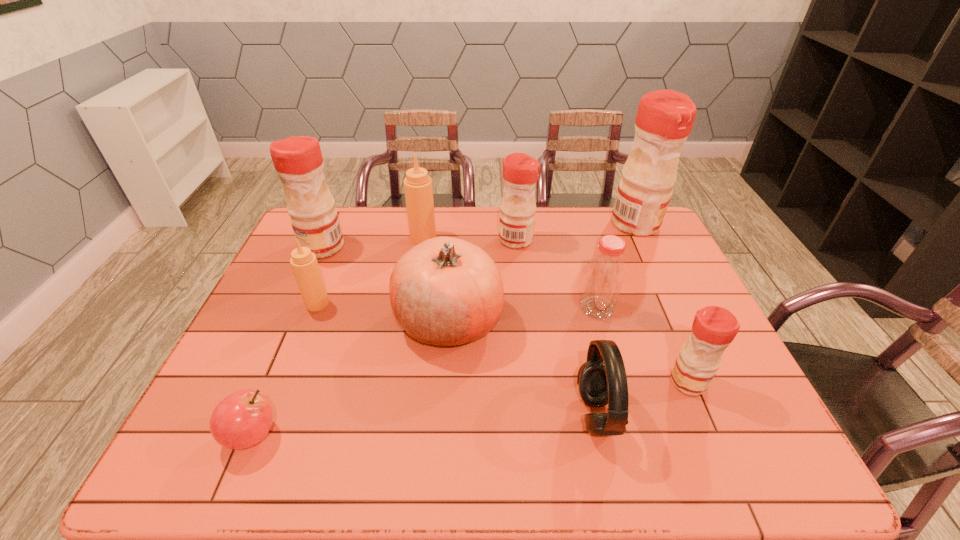
What are the coordinates of `apple at the near edge` in the screenshot? It's located at (241, 420).

The height and width of the screenshot is (540, 960). I want to click on apple at the left edge, so click(241, 420).

I want to click on object at the far left corner, so click(298, 161).

The width and height of the screenshot is (960, 540). Find the location of `object that is at the near left corner`. object that is at the near left corner is located at coordinates coord(241,420).

At what (x,y) coordinates should I click in order to perform the action: click on object that is at the far right corner. Please return your answer as a coordinate pair (x, y). Looking at the image, I should click on (665, 118).

The width and height of the screenshot is (960, 540). Find the location of `vacant point at the far edge`. vacant point at the far edge is located at coordinates (399, 222).

I want to click on vacant space at the near edge of the desktop, so click(x=368, y=438).

In the image, there is a desktop. Identify the location of vacant space at the left edge. This screenshot has width=960, height=540. (244, 355).

Locate an element on the screen. This screenshot has width=960, height=540. free space that is in between the second biggest red condiment and the biggest red condiment is located at coordinates (479, 235).

The height and width of the screenshot is (540, 960). Identify the location of vacant space that's between the nearest red condiment and the red bottle. point(642,345).